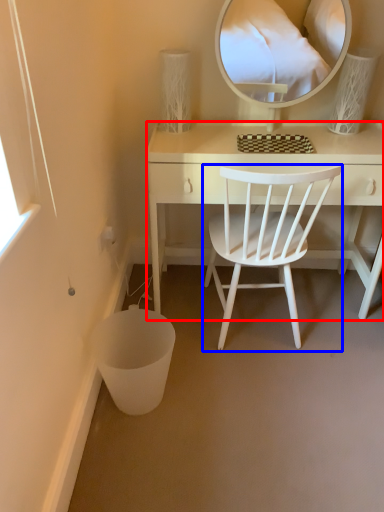
Question: Which object is further to the camera taking this photo, desk (highlighted by a red box) or chair (highlighted by a blue box)?

Choices:
 (A) desk
 (B) chair

Answer: (A)